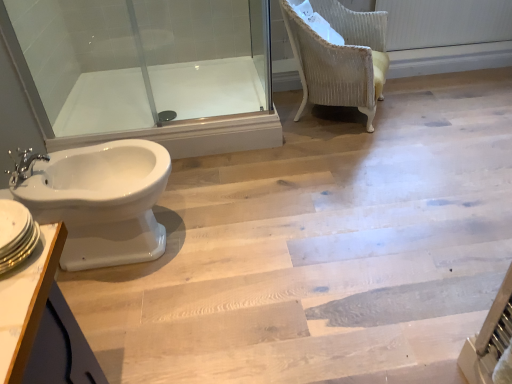
Locate an element on the screen. The height and width of the screenshot is (384, 512). free spot in front of velvet yellow chair at upper right is located at coordinates (351, 159).